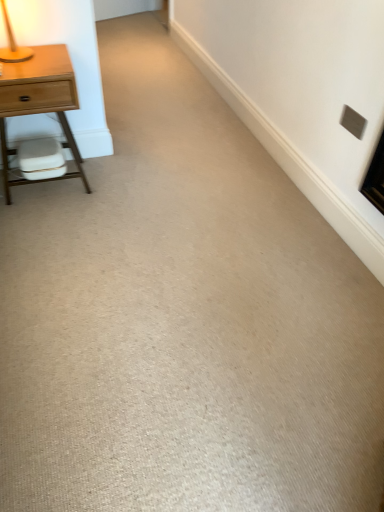
Where is `free spot below wooden table lamp at upper left (from a real-world perspective)`? The width and height of the screenshot is (384, 512). free spot below wooden table lamp at upper left (from a real-world perspective) is located at coordinates (30, 56).